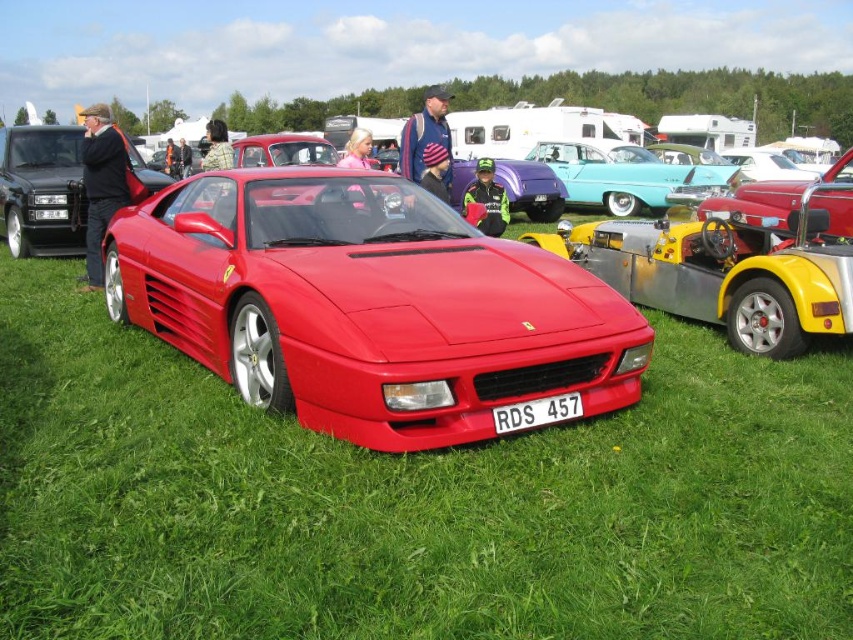
Question: Among these objects, which one is nearest to the camera?

Choices:
 (A) teal glossy sedan at center
 (B) shiny red ferrari at center

Answer: (B)

Question: Which object appears farthest from the camera in this image?

Choices:
 (A) green grass at center
 (B) white plastic license plate at center
 (C) teal glossy sedan at center

Answer: (C)

Question: Is green grass at center below glossy red car at center?

Choices:
 (A) yes
 (B) no

Answer: (A)

Question: From the image, what is the correct spatial relationship of matte red sports car at center in relation to glossy red car at center?

Choices:
 (A) above
 (B) below

Answer: (B)

Question: Can you confirm if green grass at center is thinner than glossy red car at center?

Choices:
 (A) yes
 (B) no

Answer: (A)

Question: Which of these objects is positioned farthest from the green grass at center?

Choices:
 (A) matte red sports car at center
 (B) white plastic license plate at center
 (C) shiny red ferrari at center

Answer: (A)